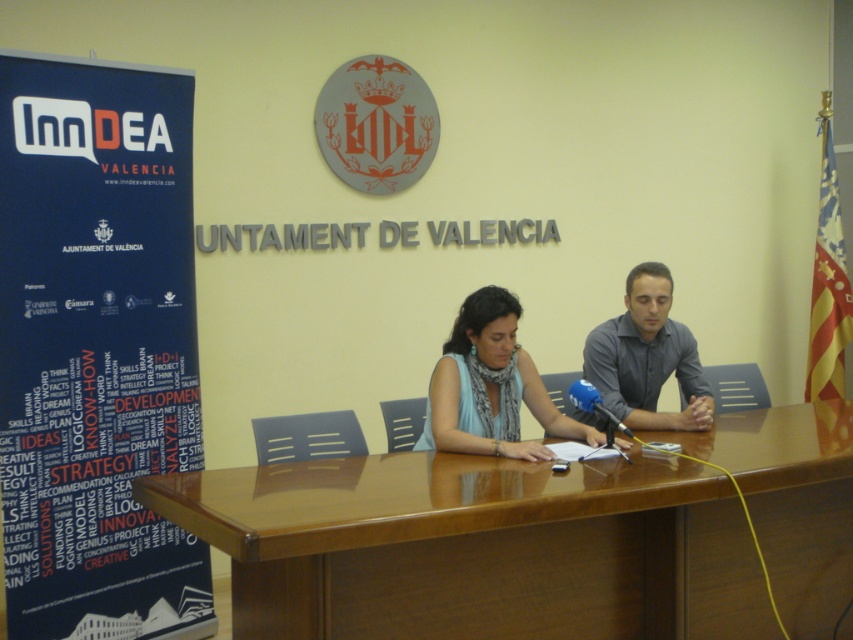
Can you confirm if glossy wood table at center is positioned to the right of gray shirt at center?

Incorrect, glossy wood table at center is not on the right side of gray shirt at center.

This screenshot has height=640, width=853. What are the coordinates of `glossy wood table at center` in the screenshot? It's located at (474, 547).

At what (x,y) coordinates should I click in order to perform the action: click on glossy wood table at center. Please return your answer as a coordinate pair (x, y). Looking at the image, I should click on (474, 547).

Is point (160, 520) positioned behind point (581, 388)?

Yes, point (160, 520) is behind point (581, 388).

Does blue fabric banner at left have a larger size compared to blue metallic microphone at center?

Yes.

Is point (122, 70) positioned in front of point (577, 387)?

No.

The width and height of the screenshot is (853, 640). I want to click on blue fabric banner at left, so click(x=96, y=348).

Is point (137, 369) less distant than point (630, 408)?

No.

Is the position of blue fabric banner at left less distant than that of gray shirt at center?

Yes, blue fabric banner at left is in front of gray shirt at center.

This screenshot has width=853, height=640. I want to click on blue fabric banner at left, so click(96, 348).

Identify the location of blue fabric banner at left. (96, 348).